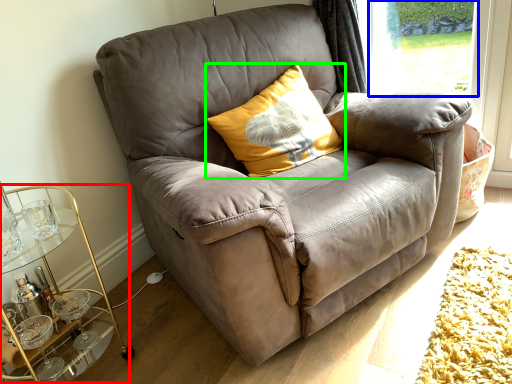
Question: Based on their relative distances, which object is farther from cocktail table (highlighted by a red box)? Choose from window screen (highlighted by a blue box) and pillow (highlighted by a green box).

Choices:
 (A) window screen
 (B) pillow

Answer: (A)